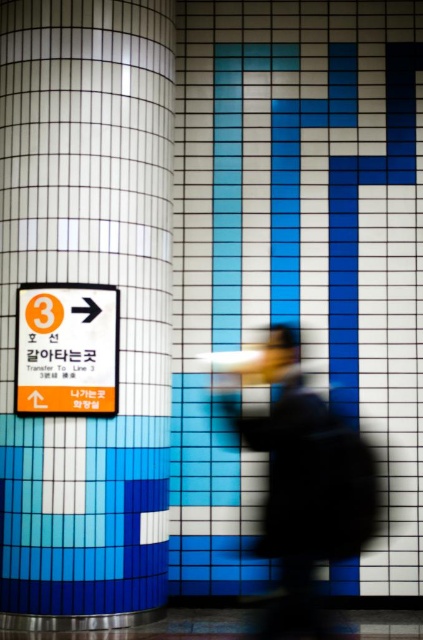
You are a passenger at the subway station and want to transfer to Line 3. You see the white glossy pillar at left and the orange plastic sign at left. Which object is higher in position?

The white glossy pillar at left is located above the orange plastic sign at left, so the white glossy pillar at left is higher.

You are a passenger standing in the subway station and want to know which object is taller between the white glossy pillar at left and the orange plastic sign at left. Can you tell me?

The white glossy pillar at left is taller than the orange plastic sign at left.